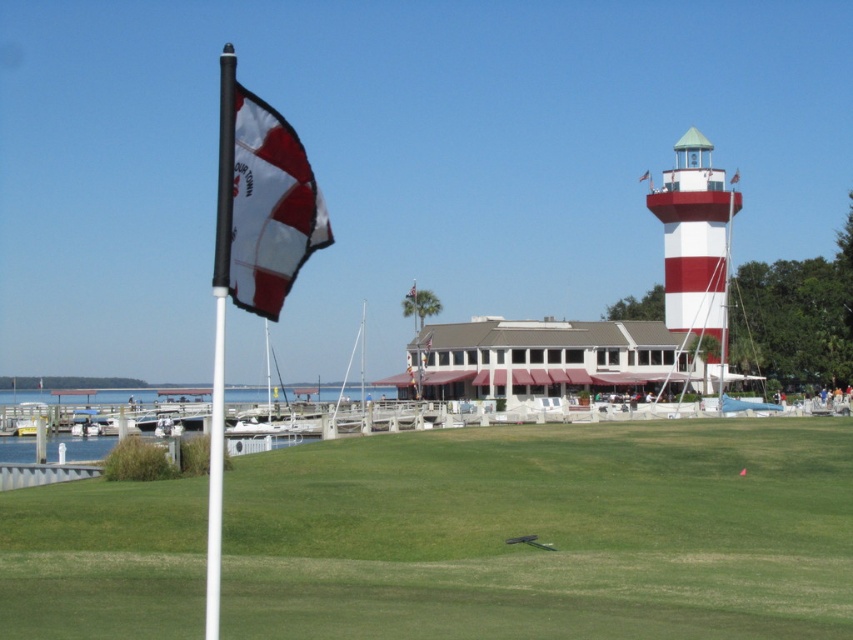
You are a photographer planning to take a picture of the waterfront scene. You want to ensure that both the green grass at center and the white matte flag at left are clearly visible in the frame. Based on their positions, which object will appear closer to the camera in the photo?

The green grass at center will appear closer to the camera because the white matte flag at left is positioned behind it.

You are standing at the edge of the waterfront scene and want to take a photo. There are two points marked in the image, point 1 at coordinates point (749,624) and point 2 at coordinates point (639,180). Which point will appear closer to you in the photo?

Point (749,624) is closer to the camera than point (639,180), so it will appear closer in the photo.